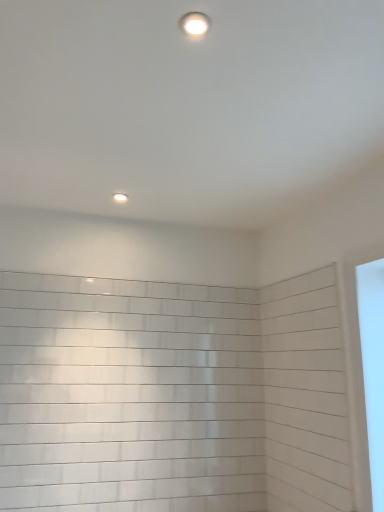
Describe the element at coordinates (120, 197) in the screenshot. I see `white glossy light fixture at upper center` at that location.

This screenshot has height=512, width=384. I want to click on white glossy light fixture at upper center, so click(x=120, y=197).

Where is `white glossy light fixture at upper center`? This screenshot has height=512, width=384. white glossy light fixture at upper center is located at coordinates (120, 197).